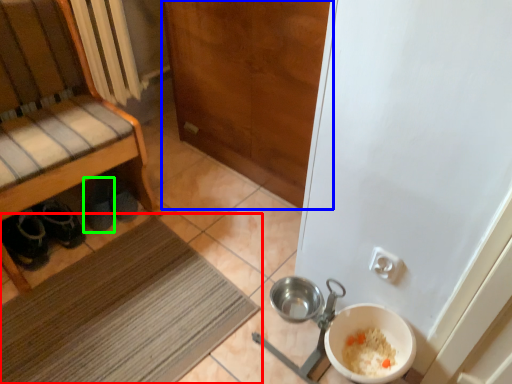
Question: Based on their relative distances, which object is farther from mat (highlighted by a red box)? Choose from door (highlighted by a blue box) and footwear (highlighted by a green box).

Choices:
 (A) door
 (B) footwear

Answer: (A)